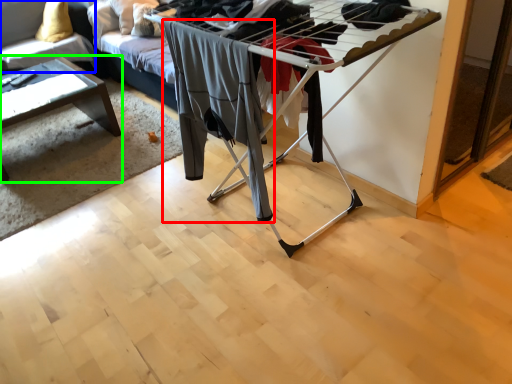
Question: Which object is positioned closest to clothing (highlighted by a red box)? Select from couch (highlighted by a blue box) and table (highlighted by a green box).

Choices:
 (A) couch
 (B) table

Answer: (B)